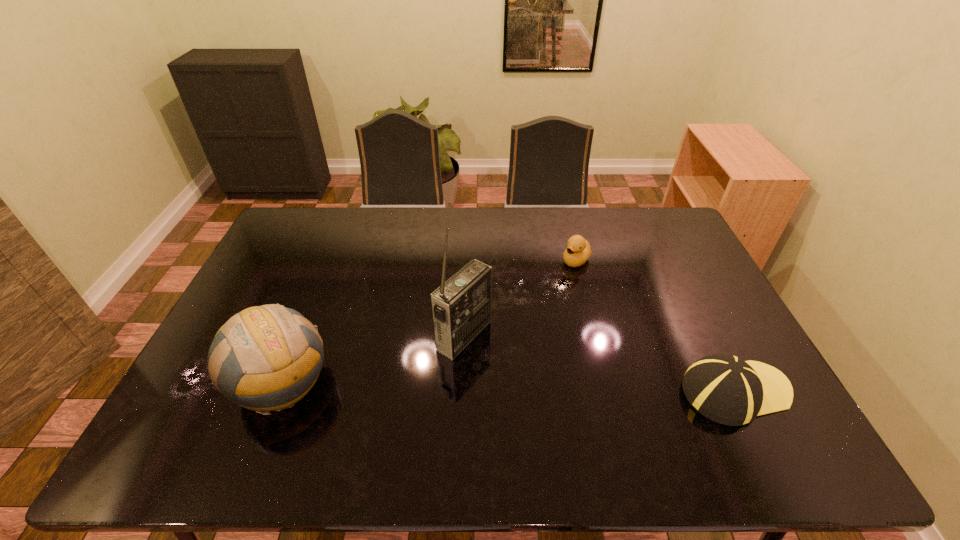
Find the location of a particular element. This screenshot has width=960, height=540. free spot located facing forward on the farthest object is located at coordinates (556, 281).

Where is `vacant region located 0.340m on the display of the radio receiver`? The height and width of the screenshot is (540, 960). vacant region located 0.340m on the display of the radio receiver is located at coordinates (599, 416).

In order to click on vacant region located on the display of the radio receiver in this screenshot , I will do `click(507, 362)`.

Find the location of a particular element. The width and height of the screenshot is (960, 540). free space located 0.080m on the display of the radio receiver is located at coordinates (510, 364).

Image resolution: width=960 pixels, height=540 pixels. I want to click on volleyball at the near edge, so click(266, 358).

The height and width of the screenshot is (540, 960). Identify the location of baseball cap located in the near edge section of the desktop. (724, 388).

Where is `object positioned at the left edge`? Image resolution: width=960 pixels, height=540 pixels. object positioned at the left edge is located at coordinates (266, 358).

You are a GUI agent. You are given a task and a screenshot of the screen. Output one action in this format:
    pyautogui.click(x=<x>, y=<y>)
    Task: Click on the object present at the right edge
    
    Given the screenshot: What is the action you would take?
    click(724, 388)

This screenshot has height=540, width=960. What are the coordinates of `object present at the near left corner` in the screenshot? It's located at (266, 358).

Locate an element on the screen. object that is positioned at the near right corner is located at coordinates (724, 388).